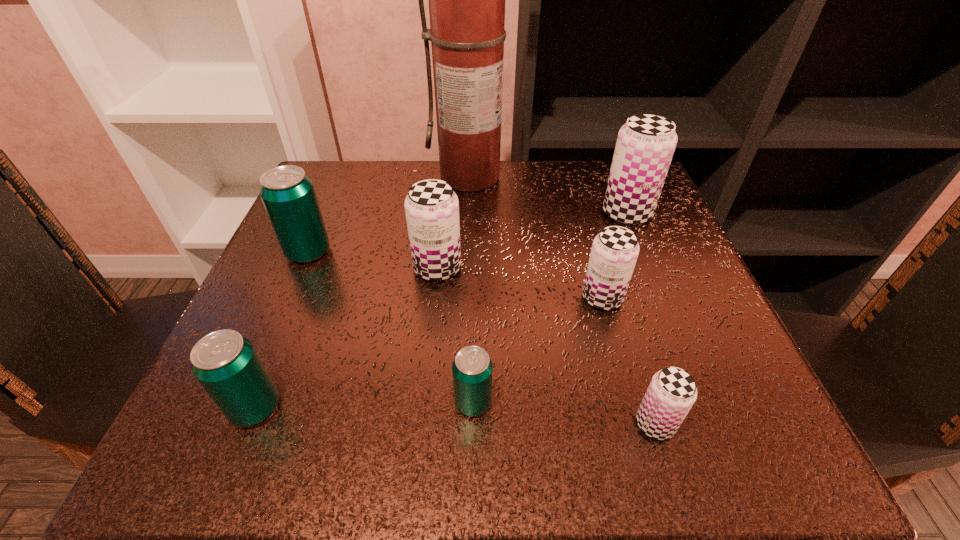
This screenshot has height=540, width=960. Identify the location of beer can identified as the fifth closest to the second smallest teal beer can. (672, 391).

Identify which purple beer can is located as the nearest to the third biggest purple beer can. Please provide its 2D coordinates. Your answer should be formatted as a tuple, i.e. [(x, y)], where the tuple contains the x and y coordinates of a point satisfying the conditions above.

[(645, 145)]

Point out which purple beer can is positioned as the third nearest to the farthest purple beer can. Please provide its 2D coordinates. Your answer should be formatted as a tuple, i.e. [(x, y)], where the tuple contains the x and y coordinates of a point satisfying the conditions above.

[(672, 391)]

Where is `teal beer can that is the second closest one to the fire extinguisher`? The image size is (960, 540). teal beer can that is the second closest one to the fire extinguisher is located at coordinates (472, 369).

Locate an element on the screen. the closest teal beer can relative to the fire extinguisher is located at coordinates (288, 195).

Find the location of `vacant space that satisfies the following two spatial constraints: 1. on the front-facing side of the farthest object; 2. on the left side of the third biggest purple beer can`. vacant space that satisfies the following two spatial constraints: 1. on the front-facing side of the farthest object; 2. on the left side of the third biggest purple beer can is located at coordinates (468, 298).

Image resolution: width=960 pixels, height=540 pixels. What are the coordinates of `free spot that satisfies the following two spatial constraints: 1. on the front-facing side of the fire extinguisher; 2. on the right side of the smallest purple beer can` in the screenshot? It's located at (466, 424).

Locate an element on the screen. The image size is (960, 540). vacant space that satisfies the following two spatial constraints: 1. on the front-facing side of the fire extinguisher; 2. on the right side of the second smallest purple beer can is located at coordinates (468, 298).

Where is `vacant region that satisfies the following two spatial constraints: 1. on the front-facing side of the biggest purple beer can; 2. on the right side of the tallest object`? vacant region that satisfies the following two spatial constraints: 1. on the front-facing side of the biggest purple beer can; 2. on the right side of the tallest object is located at coordinates (470, 213).

Where is `vacant area that satisfies the following two spatial constraints: 1. on the front-facing side of the tallest object; 2. on the right side of the biggest purple beer can`? Image resolution: width=960 pixels, height=540 pixels. vacant area that satisfies the following two spatial constraints: 1. on the front-facing side of the tallest object; 2. on the right side of the biggest purple beer can is located at coordinates (470, 213).